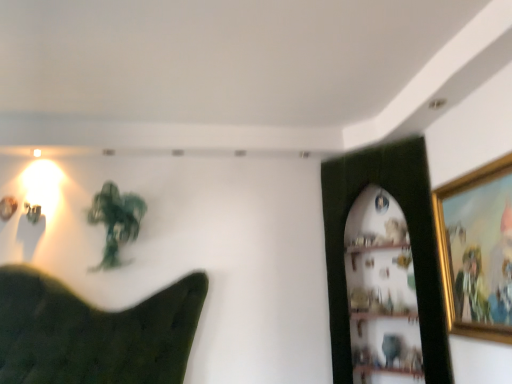
In order to face gold-framed painting at upper right, should I rotate leftwards or rightwards?

It's best to rotate right around 27.508 degrees.

This screenshot has width=512, height=384. In order to click on gold-framed painting at upper right in this screenshot , I will do `click(475, 247)`.

Describe the element at coordinates (475, 247) in the screenshot. I see `gold-framed painting at upper right` at that location.

In order to click on gold-framed painting at upper right in this screenshot , I will do `click(475, 247)`.